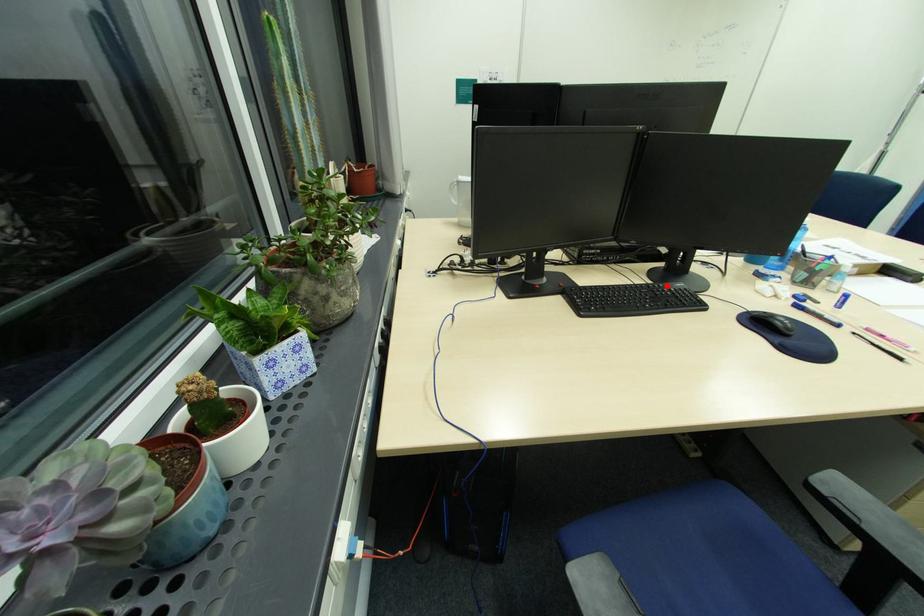
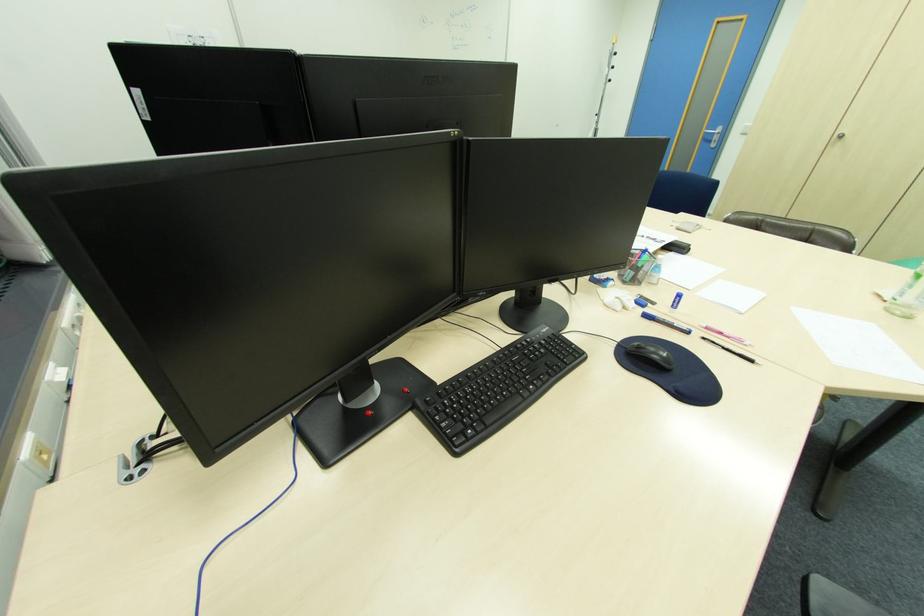
Find the pixel in the second image that matches the highlighted location in the first image.

(533, 339)